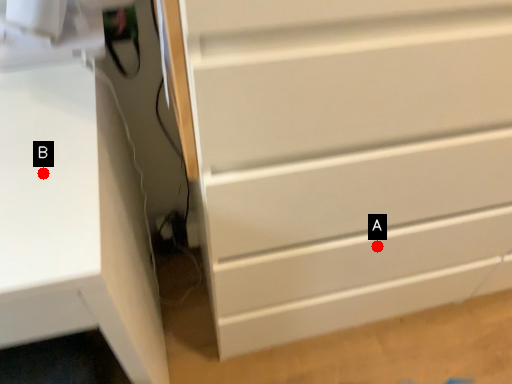
Question: Two points are circled on the image, labeled by A and B beside each circle. Which point is closer to the camera?

Choices:
 (A) A is closer
 (B) B is closer

Answer: (B)